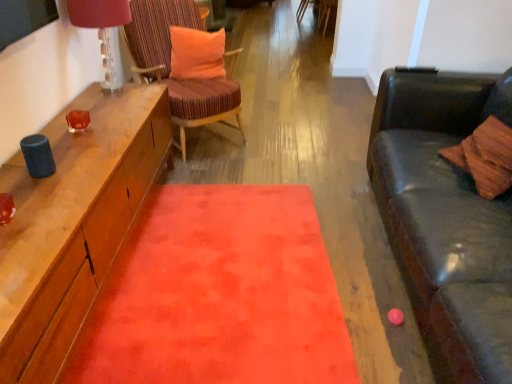
Question: Is velvet orange rug at center bigger or smaller than matte glass lampshade at upper left?

Choices:
 (A) big
 (B) small

Answer: (A)

Question: Does point (253, 200) appear closer or farther from the camera than point (128, 3)?

Choices:
 (A) farther
 (B) closer

Answer: (A)

Question: Estimate the real-world distances between objects in this image. Which object is closer to the velvet orange rug at center?

Choices:
 (A) matte glass lampshade at upper left
 (B) striped fabric chair at center
 (C) orange plush pillow at center

Answer: (B)

Question: Which of these objects is positioned closest to the orange plush pillow at center?

Choices:
 (A) striped fabric chair at center
 (B) velvet orange rug at center
 (C) matte glass lampshade at upper left

Answer: (A)